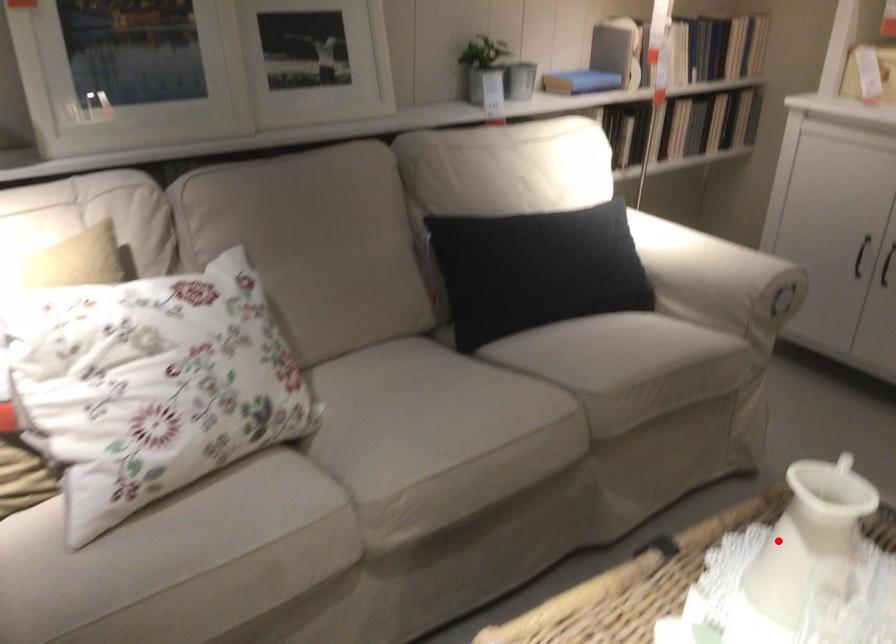
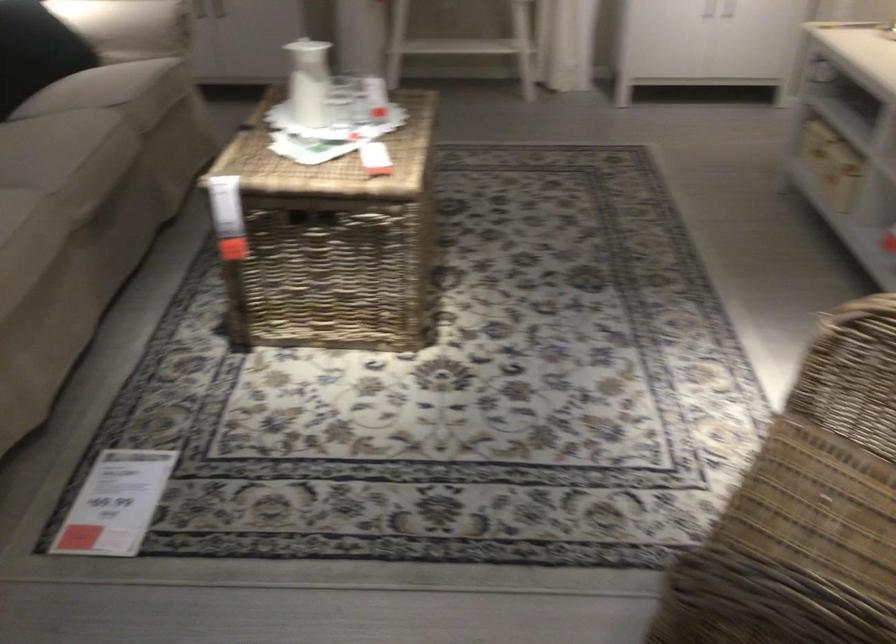
Question: I am providing you with two images of the same scene from different viewpoints. In image1, a red point is highlighted. Considering the same 3D point in image2, which of the following is correct?

Choices:
 (A) It is closer
 (B) It is farther

Answer: (B)